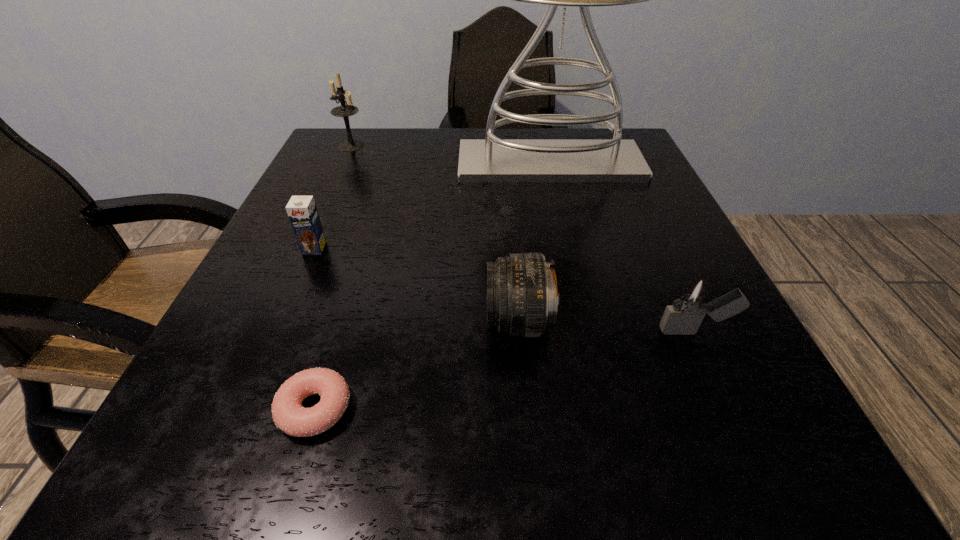
At what (x,y) coordinates should I click in order to perform the action: click on free region located 0.230m at the front element of the telephoto lens. Please return your answer as a coordinate pair (x, y). The height and width of the screenshot is (540, 960). Looking at the image, I should click on point(328,322).

This screenshot has width=960, height=540. I want to click on vacant space located 0.360m at the front element of the telephoto lens, so click(x=239, y=322).

You are a GUI agent. You are given a task and a screenshot of the screen. Output one action in this format:
    pyautogui.click(x=<x>, y=<y>)
    Task: Click on the vacant space positioned on the back of the igniter
    Image resolution: width=960 pixels, height=540 pixels.
    Given the screenshot: What is the action you would take?
    [x=639, y=208]

The width and height of the screenshot is (960, 540). What are the coordinates of `free spot located on the front label of the chocolate milk` in the screenshot? It's located at (281, 326).

Where is `vacant space located on the back of the shortest object`? vacant space located on the back of the shortest object is located at coordinates (350, 291).

I want to click on table lamp situated at the far edge, so click(491, 160).

Where is `candle holder at the far edge`? The image size is (960, 540). candle holder at the far edge is located at coordinates (345, 110).

At what (x,y) coordinates should I click in order to perform the action: click on object that is at the near edge. Please return your answer as a coordinate pair (x, y). Looking at the image, I should click on (288, 414).

The height and width of the screenshot is (540, 960). Find the location of `candle holder that is positioned at the left edge`. candle holder that is positioned at the left edge is located at coordinates (345, 110).

Find the location of a particular element. This screenshot has width=960, height=540. chocolate milk at the left edge is located at coordinates (302, 212).